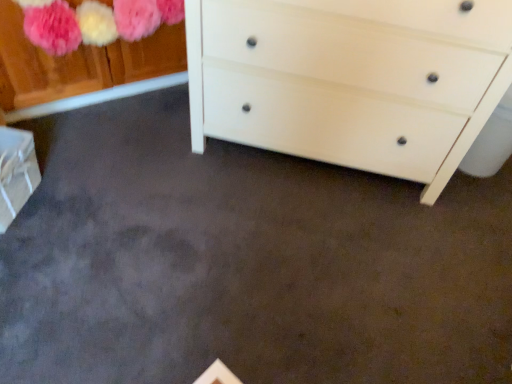
You are a GUI agent. You are given a task and a screenshot of the screen. Output one action in this format:
    pyautogui.click(x=<x>, y=<y>)
    Task: Click on the free space in front of white matte chest of drawers at center
    The width and height of the screenshot is (512, 384).
    Given the screenshot: What is the action you would take?
    pyautogui.click(x=297, y=264)